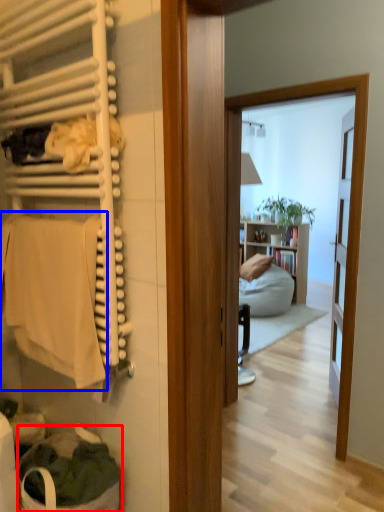
Question: Which object appears farthest to the camera in this image, laundry basket (highlighted by a red box) or bath towel (highlighted by a blue box)?

Choices:
 (A) laundry basket
 (B) bath towel

Answer: (A)